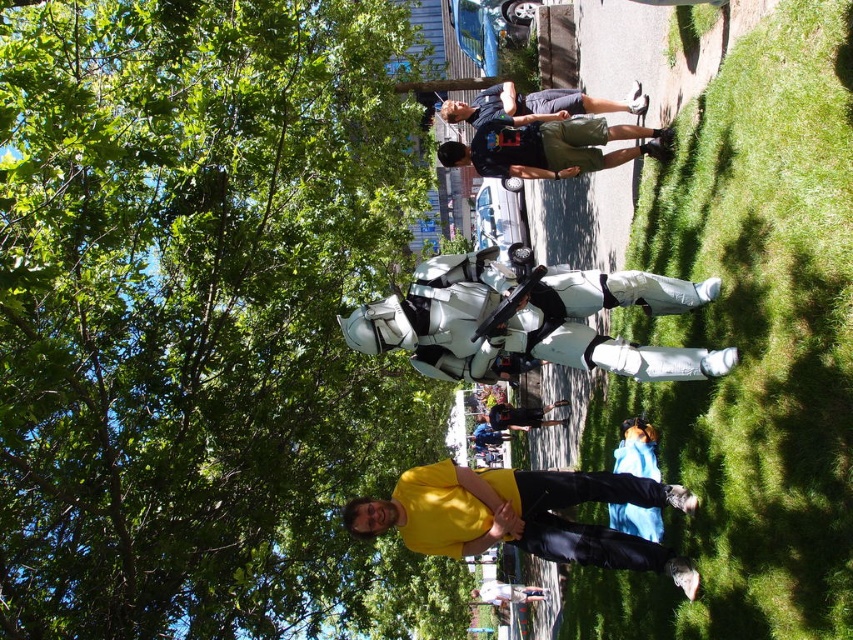
Question: Which object is farther from the camera taking this photo?

Choices:
 (A) black matte t-shirt at center
 (B) dark blue t-shirt at center

Answer: (B)

Question: Which object is positioned farthest from the green leafy tree at upper left?

Choices:
 (A) dark blue t-shirt at center
 (B) yellow matte shirt at lower center

Answer: (A)

Question: Can you confirm if black matte t-shirt at center is positioned below dark blue t-shirt at center?

Choices:
 (A) yes
 (B) no

Answer: (A)

Question: Is green leafy tree at upper left wider than yellow matte shirt at lower center?

Choices:
 (A) no
 (B) yes

Answer: (B)

Question: Which of the following is the closest to the observer?

Choices:
 (A) black matte t-shirt at center
 (B) dark blue t-shirt at center

Answer: (A)

Question: Can you confirm if green leafy tree at upper left is positioned to the left of dark blue t-shirt at center?

Choices:
 (A) yes
 (B) no

Answer: (A)